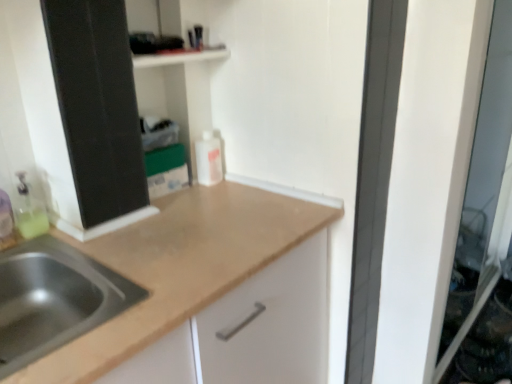
Locate an element on the screen. This screenshot has width=512, height=384. translucent plastic bottle at left is located at coordinates (30, 211).

Where is `stainless steel sink at lower left`? The height and width of the screenshot is (384, 512). stainless steel sink at lower left is located at coordinates (54, 299).

Where is `translucent plastic bottle at left`? The height and width of the screenshot is (384, 512). translucent plastic bottle at left is located at coordinates [30, 211].

Is stainless steel sink at lower left positioned far away from translucent plastic bottle at left?

No, there isn't a large distance between stainless steel sink at lower left and translucent plastic bottle at left.

How distant is stainless steel sink at lower left from translucent plastic bottle at left?

stainless steel sink at lower left and translucent plastic bottle at left are 21.88 centimeters apart from each other.

Would you say stainless steel sink at lower left is outside translucent plastic bottle at left?

stainless steel sink at lower left is positioned outside translucent plastic bottle at left.

Which of these two, stainless steel sink at lower left or translucent plastic bottle at left, is bigger?

With larger size is stainless steel sink at lower left.

Which is correct: transparent glass screen door at right is inside white matte bottle at center, or outside of it?

transparent glass screen door at right cannot be found inside white matte bottle at center.

Are transparent glass screen door at right and white matte bottle at center far apart?

That's right, there is a large distance between transparent glass screen door at right and white matte bottle at center.

Considering the relative sizes of transparent glass screen door at right and white matte bottle at center in the image provided, is transparent glass screen door at right taller than white matte bottle at center?

Yes.

Is point (200, 177) less distant than point (46, 219)?

No, it is behind (46, 219).

This screenshot has width=512, height=384. Find the location of `cleaning product that appears below the white matte bottle at center (from a real-world perspective)`. cleaning product that appears below the white matte bottle at center (from a real-world perspective) is located at coordinates 30,211.

Can you confirm if white matte bottle at center is positioned to the right of translucent plastic bottle at left?

Correct, you'll find white matte bottle at center to the right of translucent plastic bottle at left.

Considering the relative sizes of white matte bottle at center and translucent plastic bottle at left in the image provided, is white matte bottle at center thinner than translucent plastic bottle at left?

Indeed, white matte bottle at center has a lesser width compared to translucent plastic bottle at left.

Find the location of a particular element. This screenshot has width=512, height=384. cleaning product behind the stainless steel sink at lower left is located at coordinates click(x=30, y=211).

From a real-world perspective, between translucent plastic bottle at left and stainless steel sink at lower left, who is vertically higher?

In real-world perspective, translucent plastic bottle at left is above.

Consider the image. Is translucent plastic bottle at left at the right side of stainless steel sink at lower left?

No, translucent plastic bottle at left is not to the right of stainless steel sink at lower left.

From the image's perspective, is translucent plastic bottle at left over stainless steel sink at lower left?

Yes, from the image's perspective, translucent plastic bottle at left is on top of stainless steel sink at lower left.

Considering the relative sizes of stainless steel sink at lower left and white matte bottle at center in the image provided, is stainless steel sink at lower left thinner than white matte bottle at center?

In fact, stainless steel sink at lower left might be wider than white matte bottle at center.

Looking at this image, which of these two, stainless steel sink at lower left or white matte bottle at center, is bigger?

Bigger between the two is stainless steel sink at lower left.

Which point is more forward, (67,261) or (212,164)?

The point (67,261) is in front.

Is stainless steel sink at lower left further to the viewer compared to white matte bottle at center?

No, the depth of stainless steel sink at lower left is less than that of white matte bottle at center.

Where is `cleaning product located in front of the transparent glass screen door at right`? cleaning product located in front of the transparent glass screen door at right is located at coordinates (30, 211).

Who is shorter, transparent glass screen door at right or translucent plastic bottle at left?

translucent plastic bottle at left.

Can you confirm if transparent glass screen door at right is wider than translucent plastic bottle at left?

No, transparent glass screen door at right is not wider than translucent plastic bottle at left.

Is transparent glass screen door at right to the right of translucent plastic bottle at left from the viewer's perspective?

Yes.

Is translucent plastic bottle at left surrounding transparent glass screen door at right?

Actually, transparent glass screen door at right is outside translucent plastic bottle at left.

Is point (20, 207) farther from viewer compared to point (507, 282)?

No.

From the image's perspective, between translucent plastic bottle at left and transparent glass screen door at right, which one is located above?

transparent glass screen door at right.

Does translucent plastic bottle at left have a lesser height compared to transparent glass screen door at right?

Yes, translucent plastic bottle at left is shorter than transparent glass screen door at right.

In order to click on cleaning product lying behind the stainless steel sink at lower left in this screenshot , I will do `click(30, 211)`.

Identify the location of bottle that is above the transparent glass screen door at right (from a real-world perspective). (208, 159).

Based on their spatial positions, is white matte bottle at center or translucent plastic bottle at left further from stainless steel sink at lower left?

white matte bottle at center is further to stainless steel sink at lower left.

Which object lies nearer to the anchor point white matte bottle at center, stainless steel sink at lower left or transparent glass screen door at right?

stainless steel sink at lower left.

Which object lies nearer to the anchor point white matte bottle at center, translucent plastic bottle at left or stainless steel sink at lower left?

translucent plastic bottle at left is closer to white matte bottle at center.

Based on their spatial positions, is translucent plastic bottle at left or white matte bottle at center further from stainless steel sink at lower left?

white matte bottle at center is further to stainless steel sink at lower left.

Considering their positions, is translucent plastic bottle at left positioned closer to transparent glass screen door at right than white matte bottle at center?

white matte bottle at center.

Considering their positions, is white matte bottle at center positioned further to transparent glass screen door at right than stainless steel sink at lower left?

stainless steel sink at lower left.

Looking at the image, which one is located further to white matte bottle at center, stainless steel sink at lower left or translucent plastic bottle at left?

stainless steel sink at lower left lies further to white matte bottle at center than the other object.

Considering their positions, is white matte bottle at center positioned further to translucent plastic bottle at left than stainless steel sink at lower left?

white matte bottle at center is positioned further to the anchor translucent plastic bottle at left.

Locate an element on the screen. bottle between stainless steel sink at lower left and transparent glass screen door at right is located at coordinates (208, 159).

At what (x,y) coordinates should I click in order to perform the action: click on sink located between translucent plastic bottle at left and transparent glass screen door at right in the left-right direction. Please return your answer as a coordinate pair (x, y). The width and height of the screenshot is (512, 384). Looking at the image, I should click on (54, 299).

At what (x,y) coordinates should I click in order to perform the action: click on cleaning product between stainless steel sink at lower left and white matte bottle at center from front to back. Please return your answer as a coordinate pair (x, y). This screenshot has width=512, height=384. Looking at the image, I should click on (30, 211).

Locate an element on the screen. The width and height of the screenshot is (512, 384). bottle between translucent plastic bottle at left and transparent glass screen door at right in the horizontal direction is located at coordinates (208, 159).